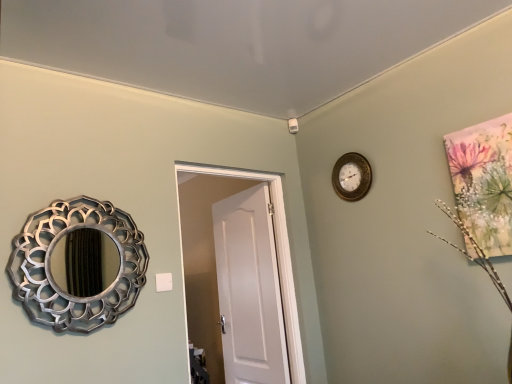
Question: From the image's perspective, relative to silver metallic mirror at left, is white matte door at center above or below?

Choices:
 (A) above
 (B) below

Answer: (B)

Question: Relative to silver metallic mirror at left, is white matte door at center in front or behind?

Choices:
 (A) behind
 (B) front

Answer: (A)

Question: Which object is the closest to the white matte door at center?

Choices:
 (A) gold metallic wall clock at upper center
 (B) silver metallic mirror at left

Answer: (A)

Question: Which of these objects is positioned farthest from the gold metallic wall clock at upper center?

Choices:
 (A) silver metallic mirror at left
 (B) white matte door at center

Answer: (A)